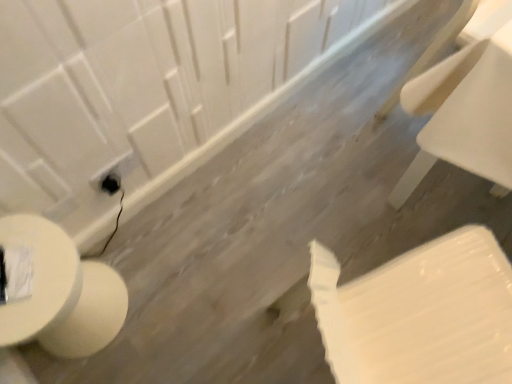
Question: Does white glossy toilet at lower left have a lesser width compared to white plastic chair at upper right?

Choices:
 (A) yes
 (B) no

Answer: (A)

Question: From the image's perspective, is white glossy toilet at lower left on top of white plastic chair at upper right?

Choices:
 (A) yes
 (B) no

Answer: (B)

Question: Is white glossy toilet at lower left further to the viewer compared to white plastic chair at upper right?

Choices:
 (A) yes
 (B) no

Answer: (B)

Question: Is white plastic chair at upper right surrounded by white glossy toilet at lower left?

Choices:
 (A) no
 (B) yes

Answer: (A)

Question: Can you confirm if white glossy toilet at lower left is positioned to the left of white plastic chair at upper right?

Choices:
 (A) yes
 (B) no

Answer: (A)

Question: In the image, is white plastic chair at upper right on the left side or the right side of white glossy toilet at lower left?

Choices:
 (A) left
 (B) right

Answer: (B)

Question: Is point [459, 77] positioned closer to the camera than point [83, 276]?

Choices:
 (A) farther
 (B) closer

Answer: (B)

Question: Based on their sizes in the image, would you say white plastic chair at upper right is bigger or smaller than white glossy toilet at lower left?

Choices:
 (A) big
 (B) small

Answer: (A)

Question: Considering the positions of white plastic chair at upper right and white glossy toilet at lower left in the image, is white plastic chair at upper right taller or shorter than white glossy toilet at lower left?

Choices:
 (A) short
 (B) tall

Answer: (B)

Question: Choose the correct answer: Is white glossy toilet paper at lower right inside white glossy toilet at lower left or outside it?

Choices:
 (A) outside
 (B) inside

Answer: (A)

Question: Is white glossy toilet paper at lower right taller or shorter than white glossy toilet at lower left?

Choices:
 (A) short
 (B) tall

Answer: (B)

Question: From a real-world perspective, is white glossy toilet paper at lower right physically located above or below white glossy toilet at lower left?

Choices:
 (A) above
 (B) below

Answer: (A)

Question: Considering their positions, is white glossy toilet paper at lower right located in front of or behind white glossy toilet at lower left?

Choices:
 (A) front
 (B) behind

Answer: (A)

Question: From a real-world perspective, relative to white glossy toilet paper at lower right, is white glossy toilet at lower left vertically above or below?

Choices:
 (A) below
 (B) above

Answer: (A)

Question: In the image, is white glossy toilet at lower left positioned in front of or behind white glossy toilet paper at lower right?

Choices:
 (A) behind
 (B) front

Answer: (A)